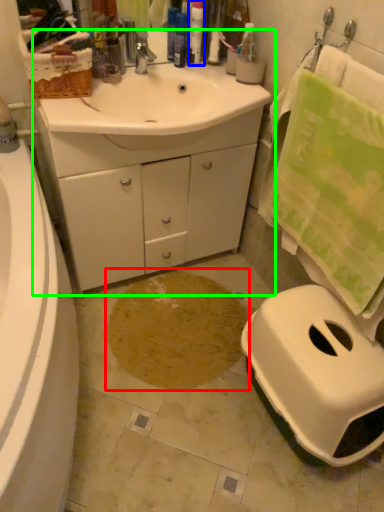
Question: Which object is the closest to the footprint (highlighted by a red box)? Choose among these: toiletry (highlighted by a blue box) or bathroom cabinet (highlighted by a green box).

Choices:
 (A) toiletry
 (B) bathroom cabinet

Answer: (B)